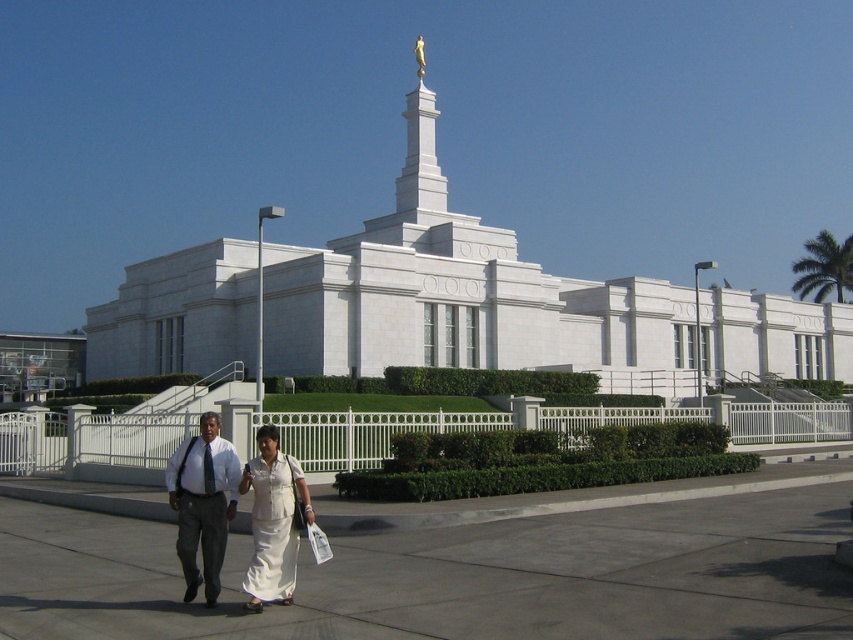
Who is more distant from viewer, (231, 570) or (190, 452)?

Positioned behind is point (231, 570).

At what (x,y) coordinates should I click in order to perform the action: click on gray concrete pavement at center. Please return your answer as a coordinate pair (x, y). Looking at the image, I should click on (454, 573).

Where is `gray concrete pavement at center`? gray concrete pavement at center is located at coordinates (454, 573).

Can you confirm if gray fabric pants at lower left is positioned above white cotton dress at center?

No.

Between point (194, 440) and point (280, 579), which one is positioned behind?

Positioned behind is point (194, 440).

I want to click on gray fabric pants at lower left, so click(x=202, y=502).

Does gray concrete pavement at center have a greater width compared to white cotton dress at center?

Yes.

Between gray concrete pavement at center and white cotton dress at center, which one is positioned higher?

white cotton dress at center

Is point (315, 612) positioned before point (283, 465)?

Yes, point (315, 612) is in front of point (283, 465).

The height and width of the screenshot is (640, 853). What are the coordinates of `gray concrete pavement at center` in the screenshot? It's located at [454, 573].